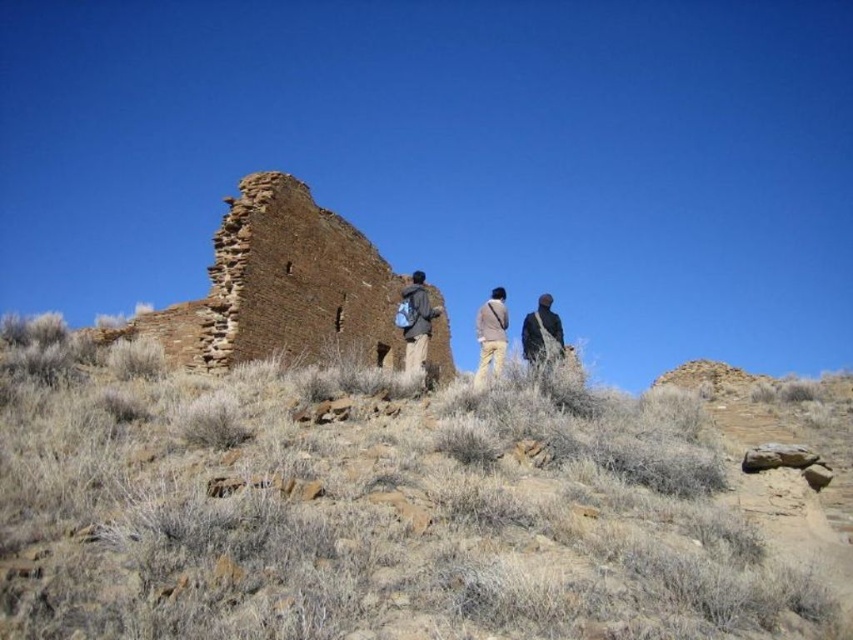
Consider the image. You are a hiker wearing khaki pants at center and you want to take a photo of the brown stone ruins at center. Since you have a wide angle lens, will the entire ruins fit in the frame if you stand where you are?

The brown stone ruins at center is larger in size than khaki pants at center, so the entire ruins may not fit in the frame if you stand where you are because the ruins are bigger than your khaki pants.

You are an archaeologist examining the desert scene. You notice a brown rock at center and a dark brown jacket at center. Which object is wider?

The brown rock at center is wider than the dark brown jacket at center.

Looking at this image, you are an archaeologist standing in the middle of the desert. You see the brown stone ruins at center and the khaki pants at center. Which object is wider?

The brown stone ruins at center is wider than the khaki pants at center as its width surpasses the khaki pants at center.